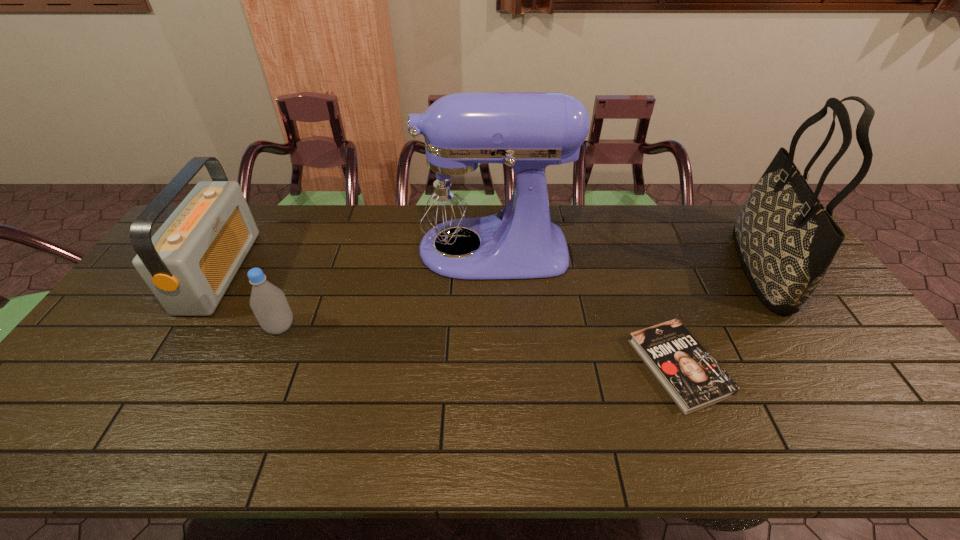
The width and height of the screenshot is (960, 540). I want to click on free space between the bottle and the fourth object from left to right, so click(x=479, y=347).

Where is `free space between the tote bag and the third object from right to left`? The image size is (960, 540). free space between the tote bag and the third object from right to left is located at coordinates (625, 258).

Find the location of a particular element. Image resolution: width=960 pixels, height=540 pixels. vacant point located between the radio receiver and the fourth object from left to right is located at coordinates (449, 319).

Locate an element on the screen. This screenshot has width=960, height=540. vacant region between the mixer and the book is located at coordinates (583, 308).

Where is `vacant region between the third object from left to right and the second object from left to right`? Image resolution: width=960 pixels, height=540 pixels. vacant region between the third object from left to right and the second object from left to right is located at coordinates (384, 288).

Where is `vacant space that is in between the second shortest object and the third object from left to right`? This screenshot has height=540, width=960. vacant space that is in between the second shortest object and the third object from left to right is located at coordinates (384, 288).

At what (x,y) coordinates should I click in order to perform the action: click on object identified as the second closest to the radio receiver. Please return your answer as a coordinate pair (x, y). The width and height of the screenshot is (960, 540). Looking at the image, I should click on (455, 193).

Choose which object is the second nearest neighbor to the book. Please provide its 2D coordinates. Your answer should be formatted as a tuple, i.e. [(x, y)], where the tuple contains the x and y coordinates of a point satisfying the conditions above.

[(455, 193)]

The image size is (960, 540). I want to click on blank area in the image that satisfies the following two spatial constraints: 1. at the mixing area of the rightmost object; 2. on the right side of the third object from right to left, so click(488, 267).

Identify the location of vacant space that satisfies the following two spatial constraints: 1. at the mixing area of the tote bag; 2. on the left side of the third object from left to right. This screenshot has width=960, height=540. (488, 267).